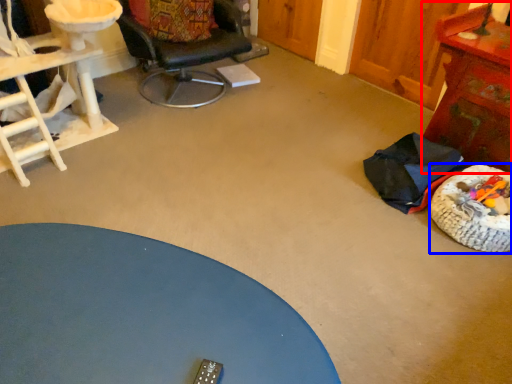
Question: Which object is further to the camera taking this photo, table (highlighted by a red box) or dog bed (highlighted by a blue box)?

Choices:
 (A) table
 (B) dog bed

Answer: (A)